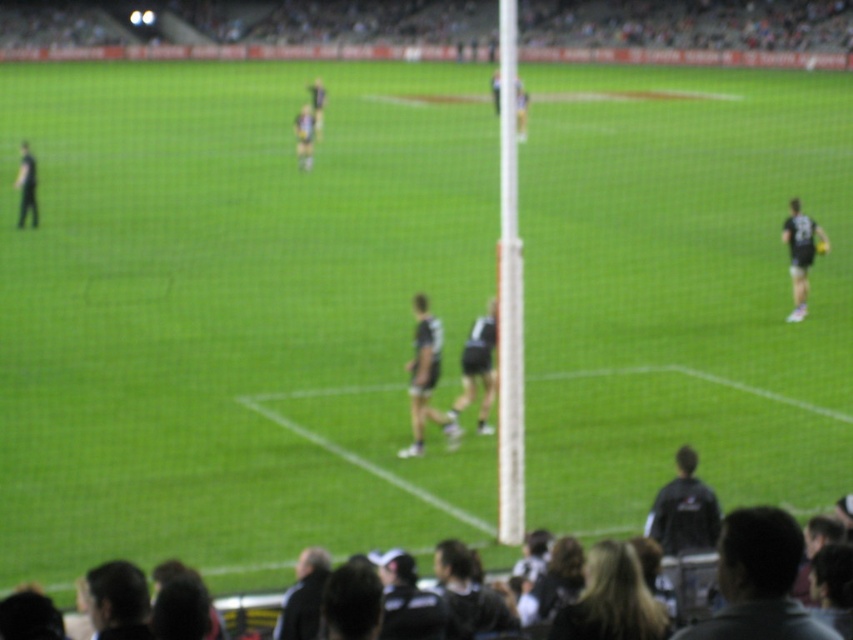
You are a photographer at the rugby match. You want to capture a photo of the black jersey at lower right and the black jersey at right. Which jersey should you zoom in on to focus on the one that is closer to you?

The black jersey at lower right is larger in size than the black jersey at right, so you should zoom in on the black jersey at lower right because it is closer to you.

You are a photographer standing at the edge of the rugby field. You want to take a photo of the black jersey at lower right and the black jersey at right. Which jersey should you focus on first to ensure both are in clear focus?

To ensure both the black jersey at lower right and the black jersey at right are in clear focus, you should focus on the black jersey at lower right first since it is closer to the viewer and has a smaller depth of field requirement compared to the one further away.